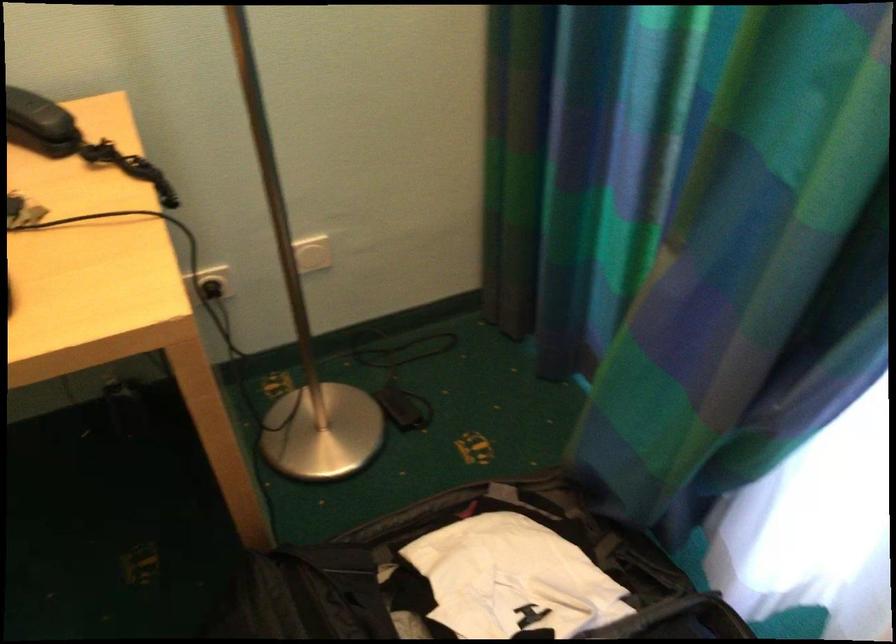
Where would you lift the telephone handset? Please return your answer as a coordinate pair (x, y).

(40, 122)